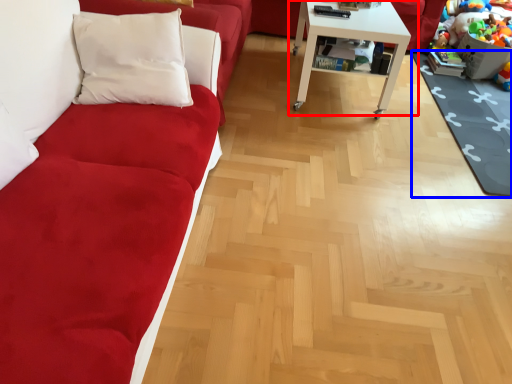
Question: Among these objects, which one is farthest to the camera, table (highlighted by a red box) or mat (highlighted by a blue box)?

Choices:
 (A) table
 (B) mat

Answer: (A)